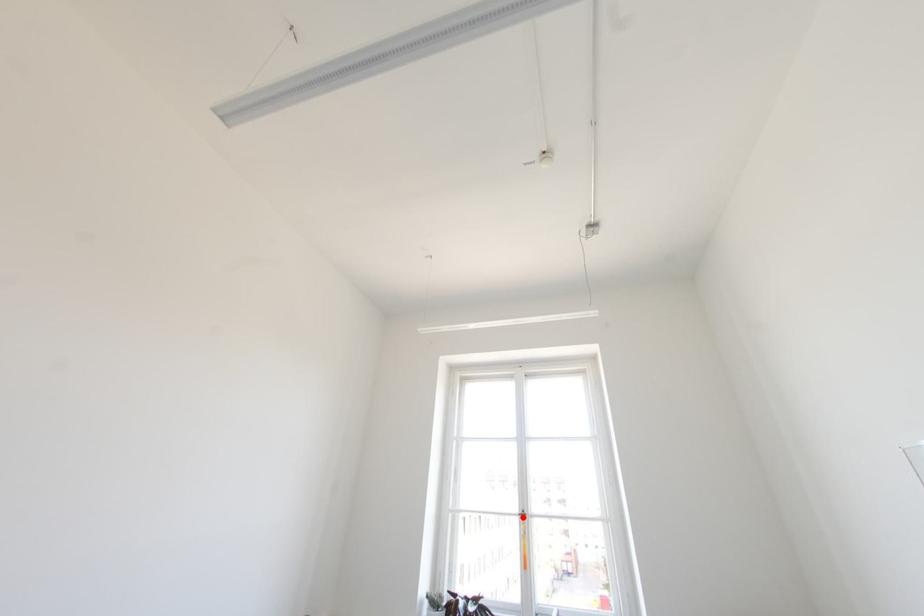
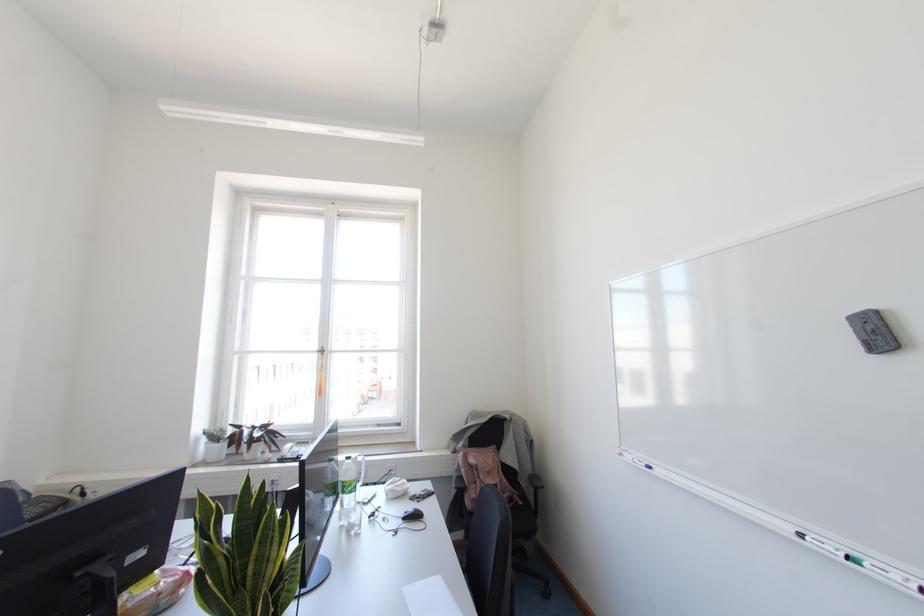
Where in the second image is the point corresponding to the highlighted location from the first image?

(322, 353)